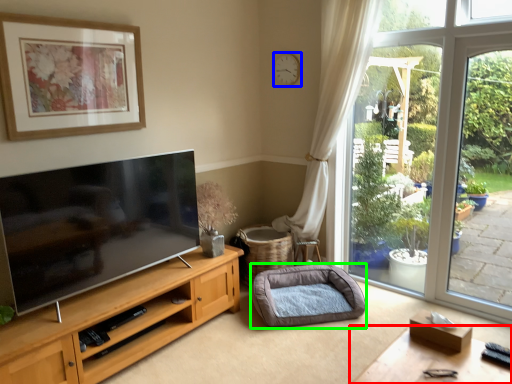
Question: Considering the real-world distances, which object is closest to table (highlighted by a red box)? clock (highlighted by a blue box) or dog bed (highlighted by a green box).

Choices:
 (A) clock
 (B) dog bed

Answer: (B)